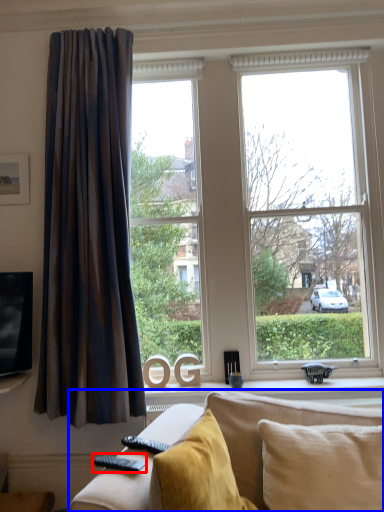
Question: Which object appears farthest to the camera in this image, remote (highlighted by a red box) or studio couch (highlighted by a blue box)?

Choices:
 (A) remote
 (B) studio couch

Answer: (A)